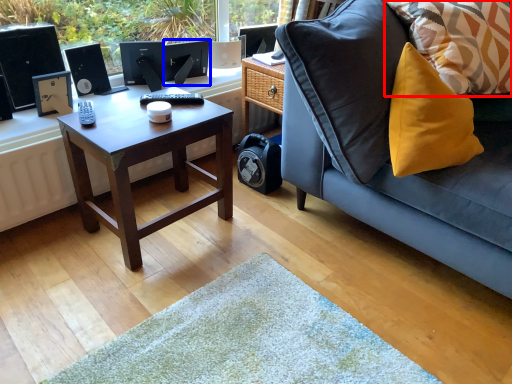
Question: Which point is closer to the camera, pillow (highlighted by a red box) or computer monitor (highlighted by a blue box)?

Choices:
 (A) pillow
 (B) computer monitor

Answer: (A)